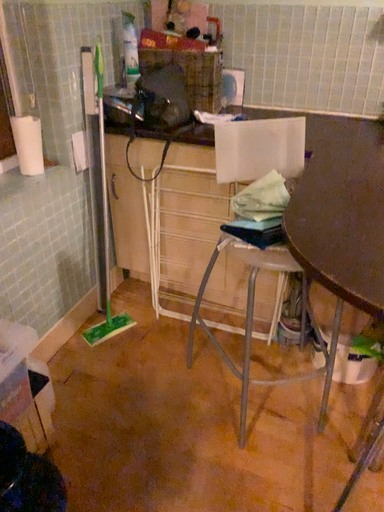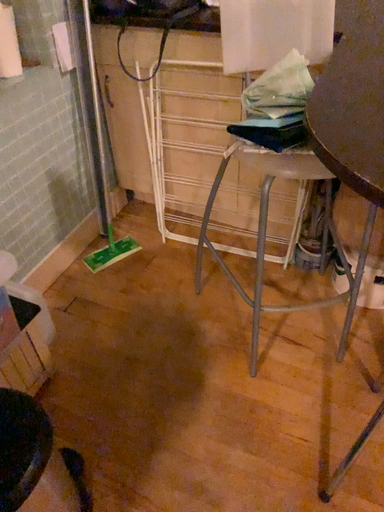
Question: Which way did the camera rotate in the video?

Choices:
 (A) rotated downward
 (B) rotated upward

Answer: (A)